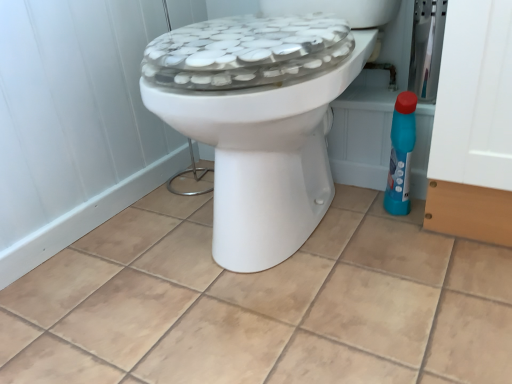
Locate an element on the screen. This screenshot has width=512, height=384. free space that is to the left of white glossy toilet at center is located at coordinates (117, 250).